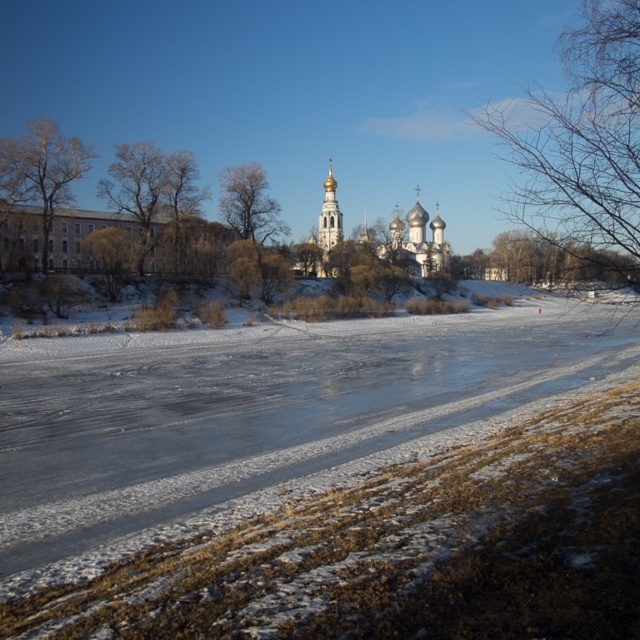
Question: Based on their relative distances, which object is farther from the bare branches at upper right?

Choices:
 (A) bare wood tree at center
 (B) brown leafless tree at left

Answer: (A)

Question: Among these objects, which one is farthest from the camera?

Choices:
 (A) golden domed church at center
 (B) bare branches at upper right

Answer: (A)

Question: Based on their relative distances, which object is farther from the brown leafless tree at left?

Choices:
 (A) brown textured tree at left
 (B) bare branches at upper right
 (C) golden domed church at center

Answer: (B)

Question: Does brown leafless tree at left have a greater width compared to brown textured tree at left?

Choices:
 (A) yes
 (B) no

Answer: (B)

Question: Does bare wood tree at center come in front of brown textured tree at left?

Choices:
 (A) yes
 (B) no

Answer: (B)

Question: Considering the relative positions of golden domed church at center and brown textured tree at left in the image provided, where is golden domed church at center located with respect to brown textured tree at left?

Choices:
 (A) right
 (B) left

Answer: (A)